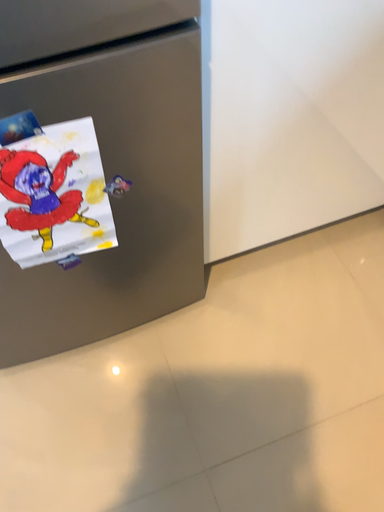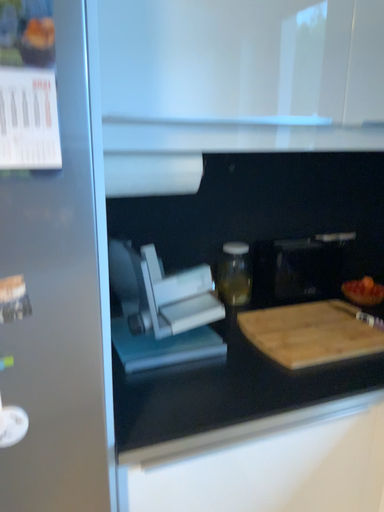
Question: Which way did the camera rotate in the video?

Choices:
 (A) rotated upward
 (B) rotated downward

Answer: (A)